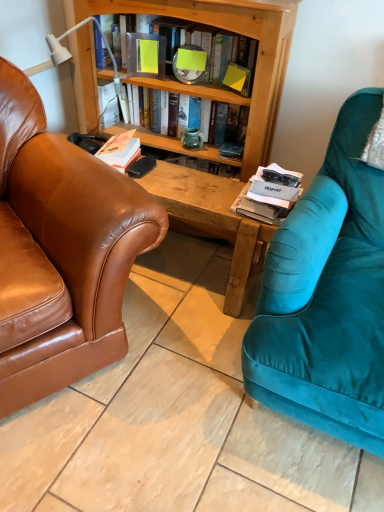
Question: From a real-world perspective, relative to teal glass vase at center, is white matte book at center, acting as the first book starting from the bottom, vertically above or below?

Choices:
 (A) above
 (B) below

Answer: (B)

Question: Considering the relative positions of white matte book at center, acting as the first book starting from the bottom, and teal glass vase at center in the image provided, is white matte book at center, acting as the first book starting from the bottom, to the left or to the right of teal glass vase at center?

Choices:
 (A) left
 (B) right

Answer: (A)

Question: Based on their relative distances, which object is farther from the white matte book at center, acting as the first book starting from the bottom?

Choices:
 (A) white paper magazine at center
 (B) teal glass vase at center
 (C) hardcover book at center, acting as the 2th book starting from the top
 (D) brown leather couch at left
 (E) matte plastic book at upper center, the third book in the bottom-to-top sequence

Answer: (A)

Question: Estimate the real-world distances between objects in this image. Which object is farther from the matte plastic book at upper center, the first book when ordered from top to bottom?

Choices:
 (A) brown leather couch at left
 (B) hardcover book at center, which is counted as the second book, starting from the bottom
 (C) white paper magazine at center
 (D) teal glass vase at center
 (E) white matte book at center, the third book when ordered from top to bottom

Answer: (A)